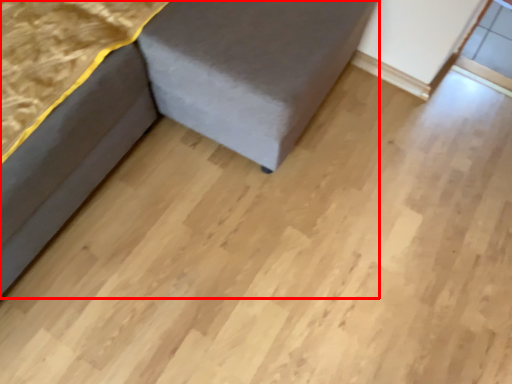
Question: From the image's perspective, what is the correct spatial positioning of furniture (annotated by the red box) in reference to furniture?

Choices:
 (A) above
 (B) below

Answer: (A)